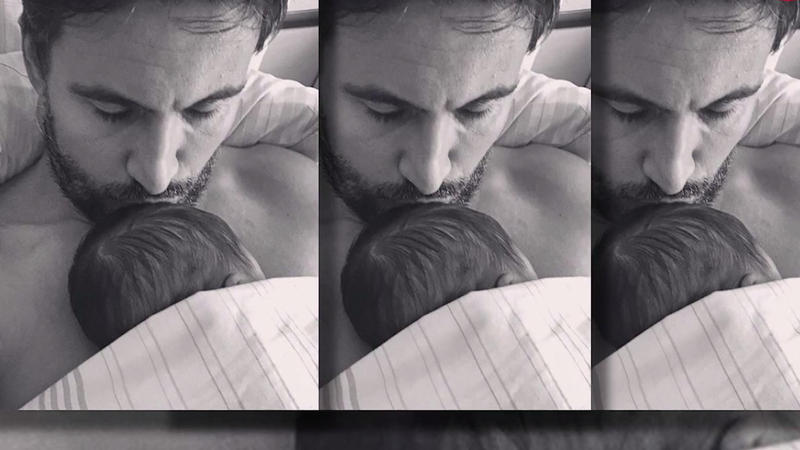
At what (x,y) coordinates should I click in order to perform the action: click on blanket. Please return your answer as a coordinate pair (x, y). Looking at the image, I should click on (730, 359), (433, 321), (193, 332).